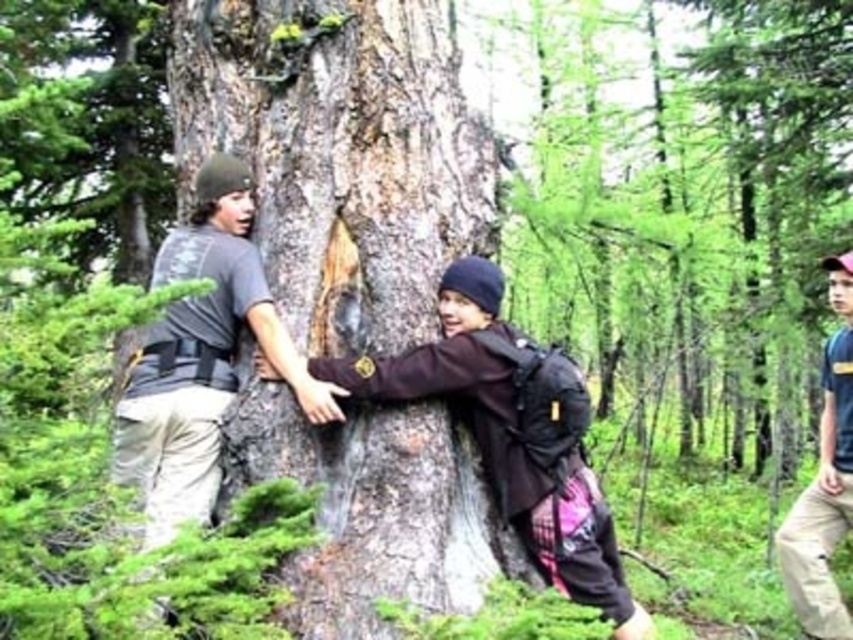
Consider the image. You are a photographer trying to capture a photo of the smooth bark tree trunk at center and the dark brown leather jacket at center. Since you want both subjects to be clearly visible in the frame, which one should you position closer to the camera to ensure clarity?

The smooth bark tree trunk at center should be positioned closer to the camera because it is on the left side of the dark brown leather jacket at center, so adjusting their positions to have the tree trunk nearer will help both appear clear in the photo.

You are an outdoor guide planning a group activity in the forest. You need to ensure that the dark brown leather jacket at center can be comfortably worn by a participant while they hug the smooth bark tree trunk at center. Based on the scene description, will the jacket interfere with hugging the tree?

The smooth bark tree trunk at center is bigger than the dark brown leather jacket at center. Since the tree trunk is larger, the jacket should not interfere with hugging the tree as there is sufficient space for the participant to wrap their arms around the trunk comfortably.